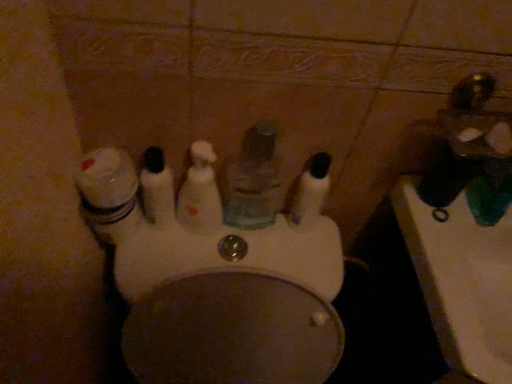
Measure the distance between translucent plastic mouthwash at center, which is counted as the third mouthwash, starting from the left, and camera.

translucent plastic mouthwash at center, which is counted as the third mouthwash, starting from the left, and camera are 24.20 inches apart.

This screenshot has width=512, height=384. In order to click on white glossy toilet at center in this screenshot , I will do `click(241, 312)`.

In the scene shown: Measure the distance between translucent plastic mouthwash at center, which is the 3th mouthwash from right to left, and camera.

translucent plastic mouthwash at center, which is the 3th mouthwash from right to left, and camera are 25.03 inches apart.

What do you see at coordinates (157, 188) in the screenshot? I see `translucent plastic mouthwash at center, which ranks as the fourth mouthwash in right-to-left order` at bounding box center [157, 188].

Find the location of a particular element. translucent plastic mouthwash at center, which ranks as the fourth mouthwash in right-to-left order is located at coordinates (157, 188).

Image resolution: width=512 pixels, height=384 pixels. What do you see at coordinates (461, 280) in the screenshot? I see `white glossy sink at lower right` at bounding box center [461, 280].

At what (x,y) coordinates should I click in order to perform the action: click on white glossy jar at left. Please return your answer as a coordinate pair (x, y). This screenshot has width=512, height=384. Looking at the image, I should click on (108, 192).

What do you see at coordinates (108, 192) in the screenshot?
I see `white glossy jar at left` at bounding box center [108, 192].

This screenshot has width=512, height=384. Identify the location of gold metallic faucet at upper right. (469, 143).

Locate an element on the screen. sink that appears below the translucent plastic mouthwash at center, which is counted as the third mouthwash, starting from the left (from a real-world perspective) is located at coordinates pyautogui.click(x=461, y=280).

Does white glossy sink at lower right contain translucent plastic mouthwash at center, which is counted as the third mouthwash, starting from the left?

Actually, translucent plastic mouthwash at center, which is counted as the third mouthwash, starting from the left, is outside white glossy sink at lower right.

From a real-world perspective, is white glossy sink at lower right physically located above or below translucent plastic mouthwash at center, which is counted as the third mouthwash, starting from the left?

white glossy sink at lower right is below translucent plastic mouthwash at center, which is counted as the third mouthwash, starting from the left.

Does point (480, 285) appear closer or farther from the camera than point (225, 185)?

Point (480, 285) appears to be farther away from the viewer than point (225, 185).

Is gold metallic faucet at upper right to the left of translucent plastic mouthwash at center, which ranks as the fourth mouthwash in right-to-left order, from the viewer's perspective?

No.

Is gold metallic faucet at upper right positioned with its back to translucent plastic mouthwash at center, marked as the 1th mouthwash in a left-to-right arrangement?

No.

Starting from the gold metallic faucet at upper right, which mouthwash is the 4th one to the left? Please provide its 2D coordinates.

[(157, 188)]

Considering the sizes of objects gold metallic faucet at upper right and translucent plastic mouthwash at center, marked as the 1th mouthwash in a left-to-right arrangement, in the image provided, who is taller, gold metallic faucet at upper right or translucent plastic mouthwash at center, marked as the 1th mouthwash in a left-to-right arrangement,?

translucent plastic mouthwash at center, marked as the 1th mouthwash in a left-to-right arrangement, is taller.

Which of these two, translucent plastic mouthwash at center, the 1th mouthwash in the right-to-left sequence, or translucent plastic mouthwash at center, marked as the 1th mouthwash in a left-to-right arrangement, stands shorter?

With less height is translucent plastic mouthwash at center, the 1th mouthwash in the right-to-left sequence.

Relative to translucent plastic mouthwash at center, marked as the 1th mouthwash in a left-to-right arrangement, is translucent plastic mouthwash at center, acting as the fourth mouthwash starting from the left, in front or behind?

translucent plastic mouthwash at center, acting as the fourth mouthwash starting from the left, is behind translucent plastic mouthwash at center, marked as the 1th mouthwash in a left-to-right arrangement.

How distant is translucent plastic mouthwash at center, acting as the fourth mouthwash starting from the left, from translucent plastic mouthwash at center, marked as the 1th mouthwash in a left-to-right arrangement?

translucent plastic mouthwash at center, acting as the fourth mouthwash starting from the left, and translucent plastic mouthwash at center, marked as the 1th mouthwash in a left-to-right arrangement, are 8.87 inches apart from each other.

Does translucent plastic mouthwash at center, the 1th mouthwash in the right-to-left sequence, have a greater width compared to translucent plastic mouthwash at center, marked as the 1th mouthwash in a left-to-right arrangement?

Indeed, translucent plastic mouthwash at center, the 1th mouthwash in the right-to-left sequence, has a greater width compared to translucent plastic mouthwash at center, marked as the 1th mouthwash in a left-to-right arrangement.

From a real-world perspective, which is physically above, translucent plastic mouthwash at center, which appears as the 2th mouthwash when viewed from the right, or translucent plastic mouthwash at center, acting as the fourth mouthwash starting from the left?

translucent plastic mouthwash at center, which appears as the 2th mouthwash when viewed from the right, from a real-world perspective.

Which of these two, translucent plastic mouthwash at center, which appears as the 2th mouthwash when viewed from the right, or translucent plastic mouthwash at center, the 1th mouthwash in the right-to-left sequence, is smaller?

translucent plastic mouthwash at center, the 1th mouthwash in the right-to-left sequence, is smaller.

Considering the positions of objects translucent plastic mouthwash at center, which appears as the 2th mouthwash when viewed from the right, and translucent plastic mouthwash at center, the 1th mouthwash in the right-to-left sequence, in the image provided, who is more to the left, translucent plastic mouthwash at center, which appears as the 2th mouthwash when viewed from the right, or translucent plastic mouthwash at center, the 1th mouthwash in the right-to-left sequence,?

Positioned to the left is translucent plastic mouthwash at center, which appears as the 2th mouthwash when viewed from the right.

Could you measure the distance between translucent plastic mouthwash at center, which appears as the 2th mouthwash when viewed from the right, and translucent plastic mouthwash at center, the 1th mouthwash in the right-to-left sequence?

They are 2.96 inches apart.

From the image's perspective, who appears lower, translucent plastic mouthwash at center, which is the 3th mouthwash from right to left, or white glossy toilet at center?

white glossy toilet at center appears lower in the image.

Based on their positions, is translucent plastic mouthwash at center, which is the second mouthwash in left-to-right order, located to the left or right of white glossy toilet at center?

Based on their positions, translucent plastic mouthwash at center, which is the second mouthwash in left-to-right order, is located to the left of white glossy toilet at center.

Between translucent plastic mouthwash at center, which is the 3th mouthwash from right to left, and white glossy toilet at center, which one is positioned behind?

translucent plastic mouthwash at center, which is the 3th mouthwash from right to left, is further from the camera.

Consider the image. Does translucent plastic mouthwash at center, which is the 3th mouthwash from right to left, have a lesser height compared to white glossy toilet at center?

Indeed, translucent plastic mouthwash at center, which is the 3th mouthwash from right to left, has a lesser height compared to white glossy toilet at center.

Does white glossy jar at left touch gold metallic faucet at upper right?

No, white glossy jar at left is not with gold metallic faucet at upper right.

Is white glossy jar at left wider or thinner than gold metallic faucet at upper right?

Clearly, white glossy jar at left has less width compared to gold metallic faucet at upper right.

Is white glossy jar at left outside of gold metallic faucet at upper right?

Absolutely, white glossy jar at left is external to gold metallic faucet at upper right.

In the scene shown: Is white glossy jar at left closer to camera compared to gold metallic faucet at upper right?

That is False.

From the image's perspective, is translucent plastic mouthwash at center, which is the 3th mouthwash from right to left, positioned above or below translucent plastic mouthwash at center, which ranks as the fourth mouthwash in right-to-left order?

Clearly, from the image's perspective, translucent plastic mouthwash at center, which is the 3th mouthwash from right to left, is below translucent plastic mouthwash at center, which ranks as the fourth mouthwash in right-to-left order.

Between translucent plastic mouthwash at center, which is the second mouthwash in left-to-right order, and translucent plastic mouthwash at center, which ranks as the fourth mouthwash in right-to-left order, which one has less height?

Standing shorter between the two is translucent plastic mouthwash at center, which ranks as the fourth mouthwash in right-to-left order.

Which is behind, translucent plastic mouthwash at center, which is the 3th mouthwash from right to left, or translucent plastic mouthwash at center, which ranks as the fourth mouthwash in right-to-left order?

translucent plastic mouthwash at center, which ranks as the fourth mouthwash in right-to-left order, is behind.

Which is closer, (209,215) or (165,209)?

The point (165,209) is in front.

Where is `the 4th mouthwash positioned above the white glossy sink at lower right (from the image's perspective)`? This screenshot has width=512, height=384. the 4th mouthwash positioned above the white glossy sink at lower right (from the image's perspective) is located at coordinates (252, 181).

Where is `mouthwash that is the 4th one when counting leftward from the gold metallic faucet at upper right`? The image size is (512, 384). mouthwash that is the 4th one when counting leftward from the gold metallic faucet at upper right is located at coordinates (157, 188).

In the scene shown: Estimate the real-world distances between objects in this image. Which object is closer to translucent plastic mouthwash at center, which is the 3th mouthwash from right to left, translucent plastic mouthwash at center, which ranks as the fourth mouthwash in right-to-left order, or translucent plastic mouthwash at center, the 1th mouthwash in the right-to-left sequence?

translucent plastic mouthwash at center, which ranks as the fourth mouthwash in right-to-left order.

Which object lies nearer to the anchor point translucent plastic mouthwash at center, which is the second mouthwash in left-to-right order, translucent plastic mouthwash at center, which appears as the 2th mouthwash when viewed from the right, or white glossy toilet at center?

The object closer to translucent plastic mouthwash at center, which is the second mouthwash in left-to-right order, is translucent plastic mouthwash at center, which appears as the 2th mouthwash when viewed from the right.

When comparing their distances from white glossy jar at left, does translucent plastic mouthwash at center, which is the 3th mouthwash from right to left, or translucent plastic mouthwash at center, which is counted as the third mouthwash, starting from the left, seem further?

translucent plastic mouthwash at center, which is counted as the third mouthwash, starting from the left, lies further to white glossy jar at left than the other object.

Estimate the real-world distances between objects in this image. Which object is closer to translucent plastic mouthwash at center, which is the second mouthwash in left-to-right order, white glossy toilet at center or translucent plastic mouthwash at center, marked as the 1th mouthwash in a left-to-right arrangement?

The object closer to translucent plastic mouthwash at center, which is the second mouthwash in left-to-right order, is translucent plastic mouthwash at center, marked as the 1th mouthwash in a left-to-right arrangement.

Considering their positions, is translucent plastic mouthwash at center, which is the 3th mouthwash from right to left, positioned closer to white glossy sink at lower right than white glossy jar at left?

translucent plastic mouthwash at center, which is the 3th mouthwash from right to left.

Estimate the real-world distances between objects in this image. Which object is further from translucent plastic mouthwash at center, marked as the 1th mouthwash in a left-to-right arrangement, white glossy toilet at center or white glossy jar at left?

Among the two, white glossy toilet at center is located further to translucent plastic mouthwash at center, marked as the 1th mouthwash in a left-to-right arrangement.

Looking at the image, which one is located closer to translucent plastic mouthwash at center, which is the second mouthwash in left-to-right order, white glossy jar at left or translucent plastic mouthwash at center, which appears as the 2th mouthwash when viewed from the right?

Based on the image, translucent plastic mouthwash at center, which appears as the 2th mouthwash when viewed from the right, appears to be nearer to translucent plastic mouthwash at center, which is the second mouthwash in left-to-right order.

When comparing their distances from white glossy jar at left, does translucent plastic mouthwash at center, acting as the fourth mouthwash starting from the left, or gold metallic faucet at upper right seem further?

gold metallic faucet at upper right lies further to white glossy jar at left than the other object.

At what (x,y) coordinates should I click in order to perform the action: click on faucet located between translucent plastic mouthwash at center, marked as the 1th mouthwash in a left-to-right arrangement, and white glossy sink at lower right in the left-right direction. Please return your answer as a coordinate pair (x, y). Looking at the image, I should click on (469, 143).

The width and height of the screenshot is (512, 384). In order to click on mouthwash situated between translucent plastic mouthwash at center, which is counted as the third mouthwash, starting from the left, and gold metallic faucet at upper right from left to right in this screenshot , I will do `click(310, 193)`.

Find the location of a particular element. mouthwash that lies between white glossy jar at left and white glossy toilet at center from top to bottom is located at coordinates (310, 193).

This screenshot has height=384, width=512. I want to click on mouthwash located between translucent plastic mouthwash at center, which is the 3th mouthwash from right to left, and translucent plastic mouthwash at center, acting as the fourth mouthwash starting from the left, in the left-right direction, so click(252, 181).